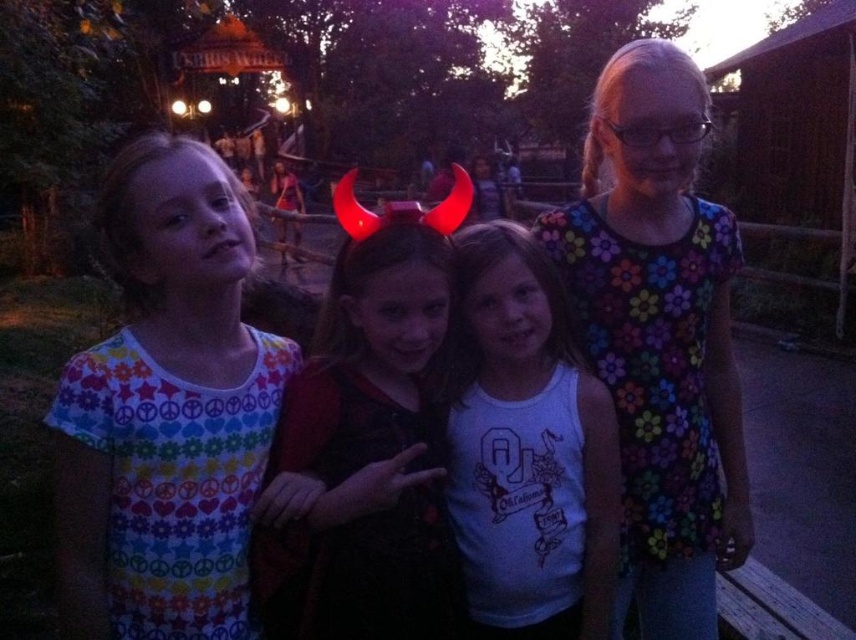
Which is above, floral-patterned shirt at right or white cotton tank top at center?

Positioned higher is floral-patterned shirt at right.

Can you confirm if floral-patterned shirt at right is positioned below white cotton tank top at center?

Actually, floral-patterned shirt at right is above white cotton tank top at center.

Find the location of a particular element. The width and height of the screenshot is (856, 640). floral-patterned shirt at right is located at coordinates (658, 333).

Locate an element on the screen. This screenshot has width=856, height=640. floral-patterned shirt at right is located at coordinates (658, 333).

Is multicolored fabric dress at left wider than floral-patterned shirt at right?

Yes.

Between point (278, 380) and point (646, 200), which one is positioned in front?

Positioned in front is point (278, 380).

The height and width of the screenshot is (640, 856). In order to click on multicolored fabric dress at left in this screenshot , I will do pyautogui.click(x=169, y=412).

Which is in front, point (426, 472) or point (484, 312)?

Point (426, 472)

Between point (259, 605) and point (461, 337), which one is positioned behind?

Point (461, 337)

This screenshot has height=640, width=856. Find the location of `black velvet horns at center`. black velvet horns at center is located at coordinates (367, 440).